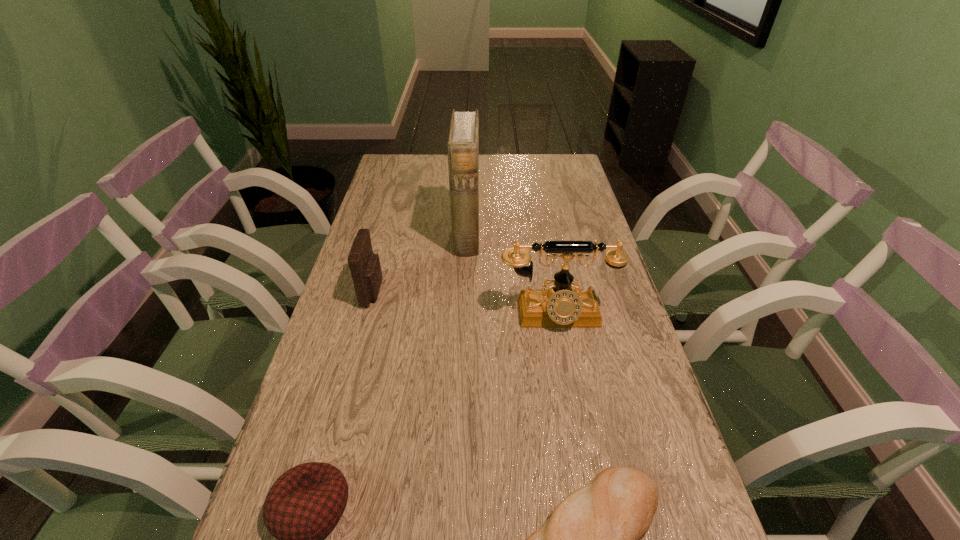
At what (x,y) coordinates should I click in order to perform the action: click on the farthest object. Please return your answer as a coordinate pair (x, y). This screenshot has height=540, width=960. Looking at the image, I should click on (463, 142).

Locate an element on the screen. This screenshot has width=960, height=540. phonebook is located at coordinates (463, 142).

Find the location of `the second tallest object`. the second tallest object is located at coordinates (559, 307).

This screenshot has height=540, width=960. I want to click on the third shortest object, so click(x=365, y=268).

The height and width of the screenshot is (540, 960). I want to click on free space located on the cover of the farthest object, so click(x=581, y=234).

Image resolution: width=960 pixels, height=540 pixels. In order to click on free space located on the dial of the second tallest object in this screenshot , I will do (x=582, y=451).

Where is `vacant region located with an open flap on the third tallest object`? This screenshot has height=540, width=960. vacant region located with an open flap on the third tallest object is located at coordinates (456, 292).

You are a GUI agent. You are given a task and a screenshot of the screen. Output one action in this format:
    pyautogui.click(x=<x>, y=<y>)
    Task: Click on the object located at the left edge
    The height and width of the screenshot is (540, 960).
    Given the screenshot: What is the action you would take?
    pyautogui.click(x=365, y=268)

I want to click on object situated at the right edge, so click(x=559, y=307).

The height and width of the screenshot is (540, 960). In order to click on free space at the far edge of the desktop in this screenshot , I will do click(x=498, y=183).